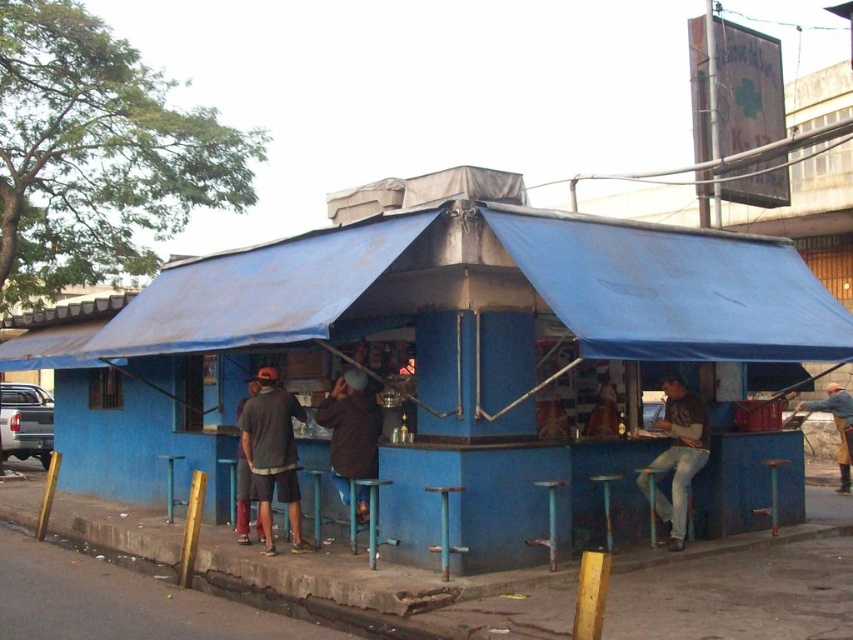
Is blue painted structure at center closer to the viewer compared to wooden stool at lower center?

That is True.

Who is more forward, (x=521, y=310) or (x=651, y=516)?

Point (x=521, y=310)

Who is more distant from viewer, (424, 412) or (651, 525)?

Positioned behind is point (651, 525).

I want to click on blue painted structure at center, so click(x=434, y=352).

Does denim jacket at lower right have a larger size compared to wooden stool at lower center?

Correct, denim jacket at lower right is larger in size than wooden stool at lower center.

Is point (840, 401) farther from camera compared to point (654, 476)?

Yes, it is.

The image size is (853, 640). I want to click on denim jacket at lower right, so click(836, 426).

Does brown matte jacket at center have a greater width compared to metallic blue stool at lower center?

Indeed, brown matte jacket at center has a greater width compared to metallic blue stool at lower center.

Does brown matte jacket at center have a lesser width compared to metallic blue stool at lower center?

No.

Is point (349, 390) in front of point (444, 545)?

That is False.

Where is `brown matte jacket at center`? The width and height of the screenshot is (853, 640). brown matte jacket at center is located at coordinates (351, 428).